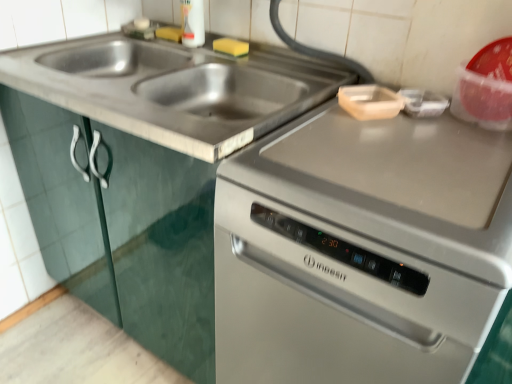
You are a GUI agent. You are given a task and a screenshot of the screen. Output one action in this format:
    pyautogui.click(x=<x>, y=<y>)
    Task: Click on the vacant space situated on the left part of yellow sponge at upper center
    The height and width of the screenshot is (384, 512).
    Given the screenshot: What is the action you would take?
    pyautogui.click(x=181, y=52)